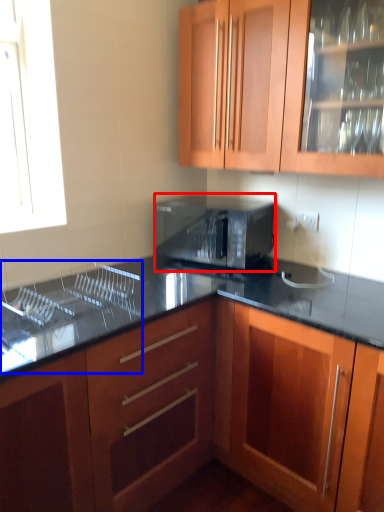
Question: Which point is closer to the camera, microwave oven (highlighted by a red box) or sink (highlighted by a blue box)?

Choices:
 (A) microwave oven
 (B) sink

Answer: (B)